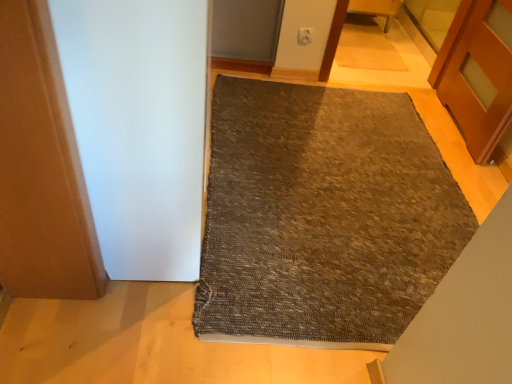
Question: Is white matte screen door at left located outside textured gray mat at center?

Choices:
 (A) no
 (B) yes

Answer: (B)

Question: Is textured gray mat at center completely or partially inside white matte screen door at left?

Choices:
 (A) yes
 (B) no

Answer: (B)

Question: From the image's perspective, is white matte screen door at left on top of textured gray mat at center?

Choices:
 (A) yes
 (B) no

Answer: (A)

Question: From a real-world perspective, is white matte screen door at left below textured gray mat at center?

Choices:
 (A) no
 (B) yes

Answer: (A)

Question: From the image's perspective, would you say white matte screen door at left is shown under textured gray mat at center?

Choices:
 (A) yes
 (B) no

Answer: (B)

Question: Considering the positions of wooden chair at upper center and textured gray mat at center in the image, is wooden chair at upper center wider or thinner than textured gray mat at center?

Choices:
 (A) thin
 (B) wide

Answer: (A)

Question: Relative to textured gray mat at center, is wooden chair at upper center in front or behind?

Choices:
 (A) front
 (B) behind

Answer: (B)

Question: Looking at the image, does wooden chair at upper center seem bigger or smaller compared to textured gray mat at center?

Choices:
 (A) small
 (B) big

Answer: (A)

Question: Would you say wooden chair at upper center is inside or outside textured gray mat at center?

Choices:
 (A) outside
 (B) inside

Answer: (A)

Question: Considering the relative positions of wooden chair at upper center and white matte screen door at left in the image provided, is wooden chair at upper center to the left or to the right of white matte screen door at left?

Choices:
 (A) right
 (B) left

Answer: (A)

Question: Is wooden chair at upper center situated inside white matte screen door at left or outside?

Choices:
 (A) outside
 (B) inside

Answer: (A)

Question: Considering the positions of point [390, 18] and point [162, 165], is point [390, 18] closer or farther from the camera than point [162, 165]?

Choices:
 (A) farther
 (B) closer

Answer: (A)

Question: Considering the positions of wooden chair at upper center and white matte screen door at left in the image, is wooden chair at upper center wider or thinner than white matte screen door at left?

Choices:
 (A) wide
 (B) thin

Answer: (B)

Question: In terms of size, does white matte screen door at left appear bigger or smaller than textured gray mat at center?

Choices:
 (A) big
 (B) small

Answer: (A)

Question: In terms of width, does white matte screen door at left look wider or thinner when compared to textured gray mat at center?

Choices:
 (A) wide
 (B) thin

Answer: (B)